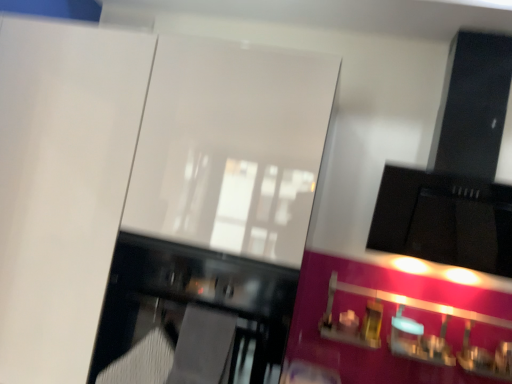
Question: Considering the relative positions of glossy black oven at lower left and pink glossy cabinet at lower right in the image provided, is glossy black oven at lower left in front of pink glossy cabinet at lower right?

Choices:
 (A) yes
 (B) no

Answer: (A)

Question: Can you confirm if glossy black oven at lower left is bigger than pink glossy cabinet at lower right?

Choices:
 (A) yes
 (B) no

Answer: (A)

Question: From a real-world perspective, is glossy black oven at lower left located beneath pink glossy cabinet at lower right?

Choices:
 (A) yes
 (B) no

Answer: (A)

Question: Is glossy black oven at lower left beside pink glossy cabinet at lower right?

Choices:
 (A) no
 (B) yes

Answer: (A)

Question: Considering the relative positions of glossy black oven at lower left and pink glossy cabinet at lower right in the image provided, is glossy black oven at lower left to the right of pink glossy cabinet at lower right from the viewer's perspective?

Choices:
 (A) no
 (B) yes

Answer: (A)

Question: From the image's perspective, does glossy black oven at lower left appear lower than pink glossy cabinet at lower right?

Choices:
 (A) yes
 (B) no

Answer: (B)

Question: Can you confirm if pink glossy cabinet at lower right is smaller than glossy black oven at lower left?

Choices:
 (A) no
 (B) yes

Answer: (B)

Question: Is glossy black oven at lower left a part of pink glossy cabinet at lower right?

Choices:
 (A) no
 (B) yes

Answer: (A)

Question: Is pink glossy cabinet at lower right far from glossy black oven at lower left?

Choices:
 (A) no
 (B) yes

Answer: (A)

Question: Is pink glossy cabinet at lower right oriented towards glossy black oven at lower left?

Choices:
 (A) no
 (B) yes

Answer: (A)

Question: Can we say pink glossy cabinet at lower right lies outside glossy black oven at lower left?

Choices:
 (A) no
 (B) yes

Answer: (B)

Question: From the image's perspective, does pink glossy cabinet at lower right appear higher than glossy black oven at lower left?

Choices:
 (A) yes
 (B) no

Answer: (B)

Question: Is point (432, 362) positioned closer to the camera than point (288, 271)?

Choices:
 (A) closer
 (B) farther

Answer: (B)